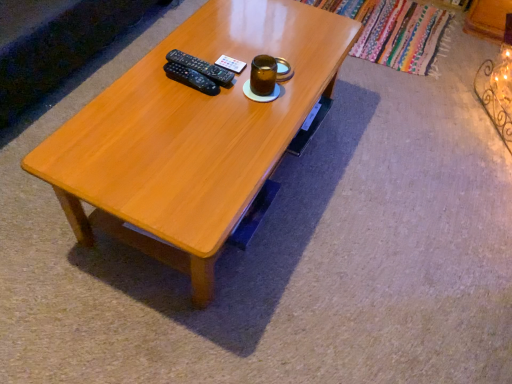
Question: In terms of width, does light brown wood coffee table at center look wider or thinner when compared to black plastic remote at center?

Choices:
 (A) thin
 (B) wide

Answer: (B)

Question: Choose the correct answer: Is light brown wood coffee table at center inside black plastic remote at center or outside it?

Choices:
 (A) inside
 (B) outside

Answer: (B)

Question: Estimate the real-world distances between objects in this image. Which object is farther from the black plastic remote at center?

Choices:
 (A) brown glass jar at upper center
 (B) light brown wood coffee table at center

Answer: (B)

Question: Estimate the real-world distances between objects in this image. Which object is closer to the brown glass jar at upper center?

Choices:
 (A) light brown wood coffee table at center
 (B) black plastic remote at center

Answer: (B)